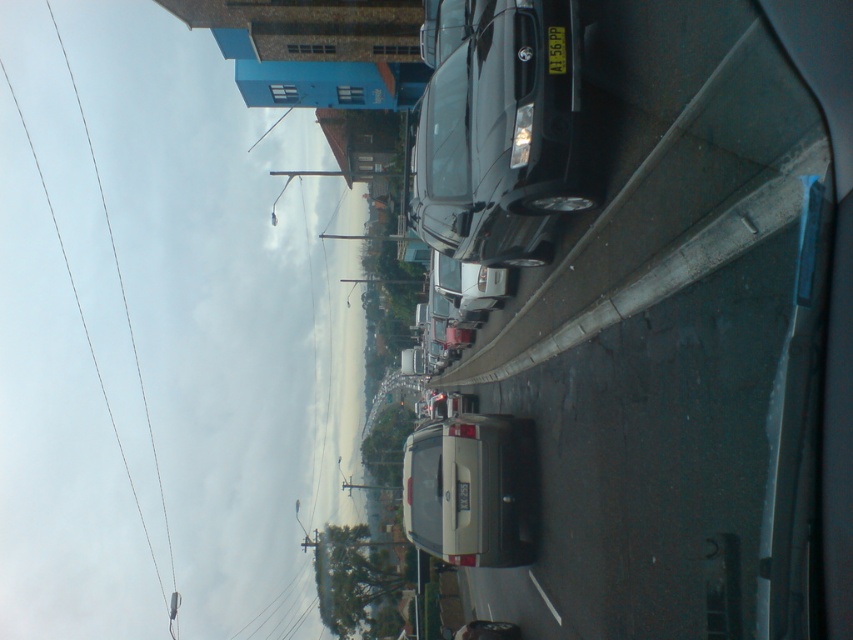
Question: Estimate the real-world distances between objects in this image. Which object is farther from the matte silver van at center?

Choices:
 (A) shiny black car at center
 (B) black plastic license plate at center

Answer: (B)

Question: Can you confirm if shiny black car at center is smaller than matte silver van at center?

Choices:
 (A) no
 (B) yes

Answer: (A)

Question: Can you confirm if matte silver van at center is positioned to the left of black plastic license plate at center?

Choices:
 (A) no
 (B) yes

Answer: (B)

Question: Based on their relative distances, which object is nearer to the shiny black car at center?

Choices:
 (A) matte silver van at center
 (B) black plastic license plate at center

Answer: (B)

Question: Can you confirm if shiny black car at center is positioned below matte silver van at center?

Choices:
 (A) yes
 (B) no

Answer: (B)

Question: Which point appears closest to the camera in this image?

Choices:
 (A) (508, 621)
 (B) (448, 227)

Answer: (B)